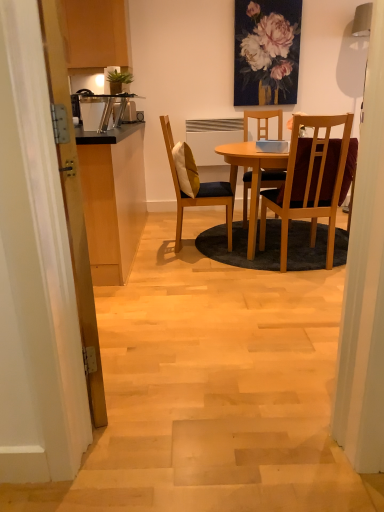
Question: Would you say wooden chair with dark cushioning at center, which ranks as the 1th chair in right-to-left order, is to the left or to the right of matte floral painting at upper center in the picture?

Choices:
 (A) right
 (B) left

Answer: (A)

Question: Considering the positions of wooden chair with dark cushioning at center, the second chair from the left, and matte floral painting at upper center in the image, is wooden chair with dark cushioning at center, the second chair from the left, bigger or smaller than matte floral painting at upper center?

Choices:
 (A) small
 (B) big

Answer: (B)

Question: Estimate the real-world distances between objects in this image. Which object is farther from the matte floral painting at upper center?

Choices:
 (A) wooden chair with dark cushioning at center, the second chair from the left
 (B) wooden chair with cushion at center, positioned as the 2th chair in right-to-left order
 (C) wooden table at center
 (D) wooden door at left
 (E) yellow fabric pillow at center

Answer: (D)

Question: Based on their relative distances, which object is nearer to the wooden table at center?

Choices:
 (A) wooden door at left
 (B) wooden chair with cushion at center, positioned as the 2th chair in right-to-left order
 (C) yellow fabric pillow at center
 (D) matte floral painting at upper center
 (E) wooden chair with dark cushioning at center, the second chair from the left

Answer: (E)